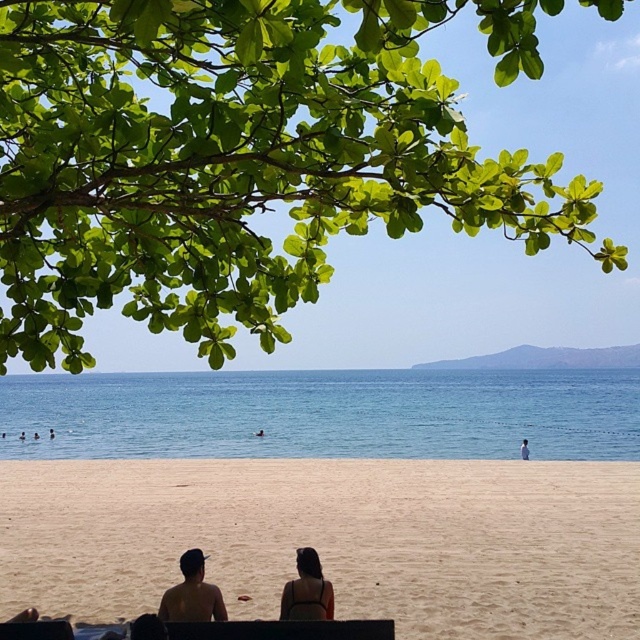
Question: Can you confirm if sandy beige at lower center is thinner than smooth skin person at lower left?

Choices:
 (A) yes
 (B) no

Answer: (B)

Question: From the image, what is the correct spatial relationship of sandy beige at lower center in relation to matte black swimsuit at center?

Choices:
 (A) right
 (B) left

Answer: (A)

Question: Which of the following is the farthest from the observer?

Choices:
 (A) (220, 600)
 (B) (522, 454)

Answer: (B)

Question: Which of these objects is positioned closest to the green leafy branch at upper left?

Choices:
 (A) smooth skin person at center
 (B) white cotton shirt at lower center
 (C) smooth skin person at lower left

Answer: (B)

Question: Is blue water at center below white cotton shirt at lower center?

Choices:
 (A) yes
 (B) no

Answer: (B)

Question: Which of the following is the closest to the observer?

Choices:
 (A) (52, 432)
 (B) (330, 609)
 (C) (321, 605)
 (D) (173, 436)

Answer: (C)